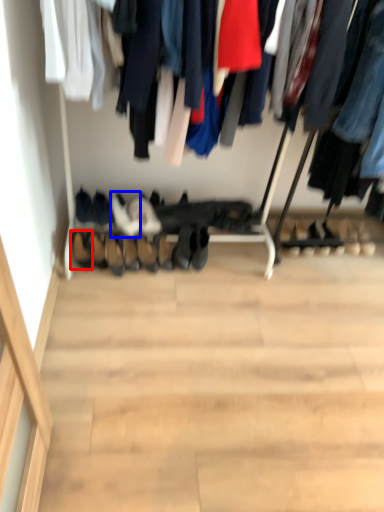
Question: Which point is closer to the camera, shoe (highlighted by a red box) or footwear (highlighted by a blue box)?

Choices:
 (A) shoe
 (B) footwear

Answer: (A)